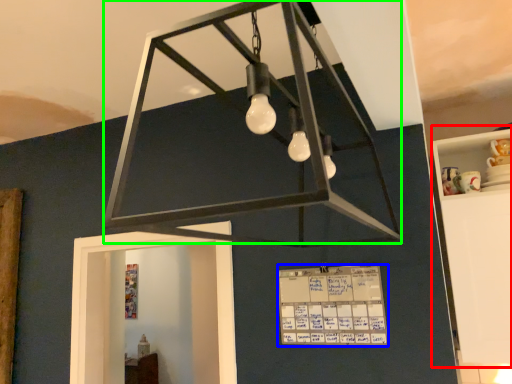
Question: Based on their relative distances, which object is farther from furniture (highlighted by a red box)? Choose from writing (highlighted by a blue box) and lamp (highlighted by a green box).

Choices:
 (A) writing
 (B) lamp

Answer: (B)